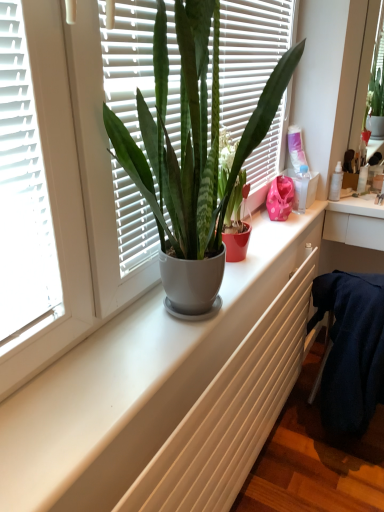
Question: From a real-world perspective, does matte white pot at center stand above transparent plastic bottle at upper right?

Choices:
 (A) yes
 (B) no

Answer: (A)

Question: Considering the relative positions of matte white pot at center and transparent plastic bottle at upper right in the image provided, is matte white pot at center to the right of transparent plastic bottle at upper right from the viewer's perspective?

Choices:
 (A) no
 (B) yes

Answer: (A)

Question: Does matte white pot at center have a greater width compared to transparent plastic bottle at upper right?

Choices:
 (A) yes
 (B) no

Answer: (B)

Question: Does matte white pot at center have a lesser height compared to transparent plastic bottle at upper right?

Choices:
 (A) no
 (B) yes

Answer: (A)

Question: From a real-world perspective, is matte white pot at center beneath transparent plastic bottle at upper right?

Choices:
 (A) no
 (B) yes

Answer: (A)

Question: Considering the relative positions of matte white pot at center and transparent plastic bottle at upper right in the image provided, is matte white pot at center behind transparent plastic bottle at upper right?

Choices:
 (A) yes
 (B) no

Answer: (B)

Question: Is matte white pot at center aimed at white matte radiator at center?

Choices:
 (A) yes
 (B) no

Answer: (B)

Question: From a real-world perspective, is matte white pot at center under white matte radiator at center?

Choices:
 (A) yes
 (B) no

Answer: (B)

Question: Does matte white pot at center touch white matte radiator at center?

Choices:
 (A) yes
 (B) no

Answer: (B)

Question: Are matte white pot at center and white matte radiator at center located far from each other?

Choices:
 (A) no
 (B) yes

Answer: (A)

Question: From the image's perspective, does matte white pot at center appear higher than white matte radiator at center?

Choices:
 (A) no
 (B) yes

Answer: (B)

Question: Does matte white pot at center have a greater width compared to white matte radiator at center?

Choices:
 (A) yes
 (B) no

Answer: (B)

Question: Is white matte radiator at center to the left of matte white pot at center from the viewer's perspective?

Choices:
 (A) yes
 (B) no

Answer: (B)